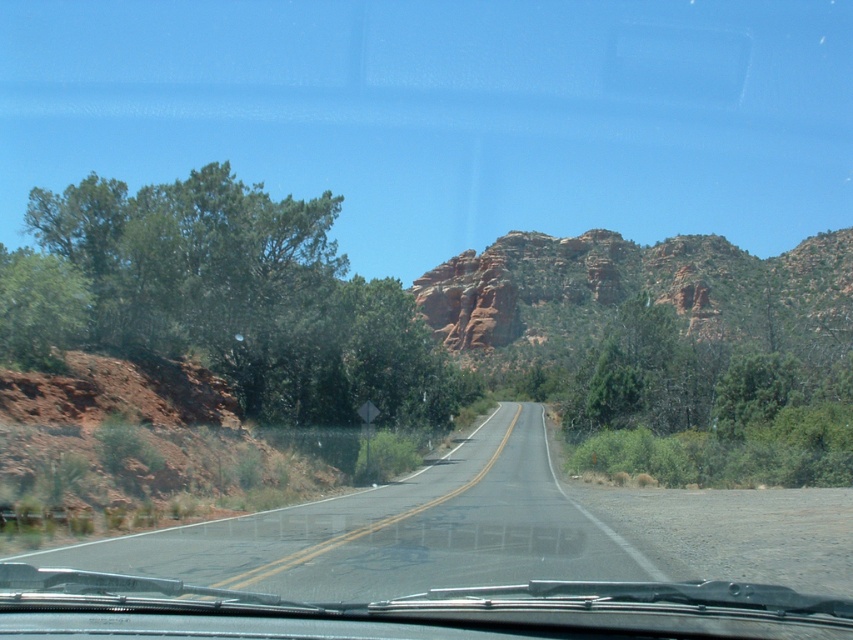
Question: Which point is farther to the camera?

Choices:
 (A) (409, 515)
 (B) (828, 323)

Answer: (B)

Question: In this image, where is asphalt road at center located relative to reddish-brown rock formation at center?

Choices:
 (A) above
 (B) below

Answer: (B)

Question: Can you confirm if asphalt road at center is thinner than reddish-brown rock formation at center?

Choices:
 (A) no
 (B) yes

Answer: (B)

Question: Which point is closer to the camera?

Choices:
 (A) reddish-brown rock formation at center
 (B) asphalt road at center

Answer: (B)

Question: Is asphalt road at center closer to camera compared to reddish-brown rock formation at center?

Choices:
 (A) yes
 (B) no

Answer: (A)